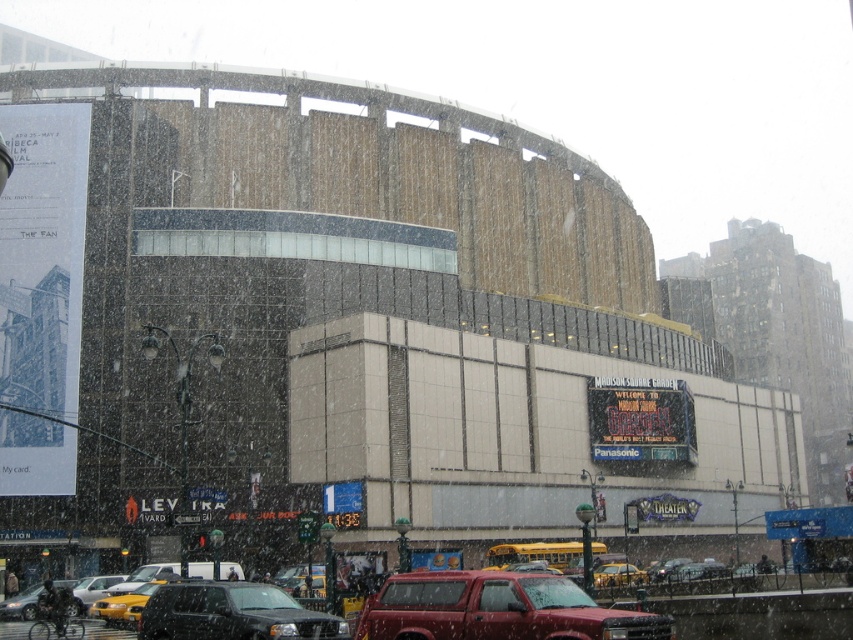
Which is more to the right, matte red truck at center or matte black car at lower left?

matte red truck at center is more to the right.

Does matte red truck at center have a greater height compared to matte black car at lower left?

No, matte red truck at center is not taller than matte black car at lower left.

The width and height of the screenshot is (853, 640). What do you see at coordinates (497, 609) in the screenshot?
I see `matte red truck at center` at bounding box center [497, 609].

You are a GUI agent. You are given a task and a screenshot of the screen. Output one action in this format:
    pyautogui.click(x=<x>, y=<y>)
    Task: Click on the matte red truck at center
    This screenshot has width=853, height=640.
    Given the screenshot: What is the action you would take?
    [x=497, y=609]

Does black matte suv at lower center appear on the left side of matte black car at lower left?

No, black matte suv at lower center is not to the left of matte black car at lower left.

The width and height of the screenshot is (853, 640). Identify the location of black matte suv at lower center. (231, 612).

Where is `black matte suv at lower center`? This screenshot has height=640, width=853. black matte suv at lower center is located at coordinates (231, 612).

Who is shorter, black matte suv at lower center or yellow rubber taxi at center?

Standing shorter between the two is yellow rubber taxi at center.

Describe the element at coordinates (231, 612) in the screenshot. The image size is (853, 640). I see `black matte suv at lower center` at that location.

Locate an element on the screen. The width and height of the screenshot is (853, 640). black matte suv at lower center is located at coordinates (231, 612).